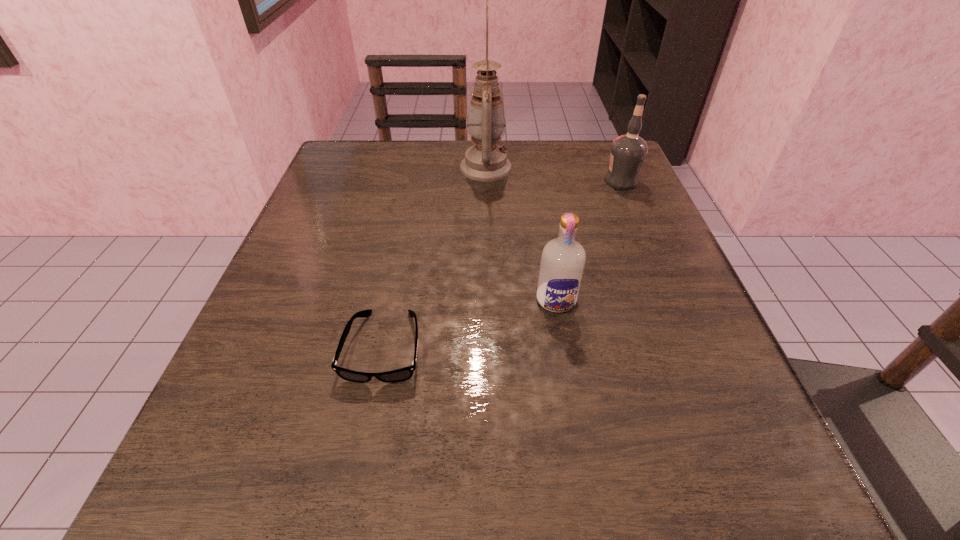
This screenshot has height=540, width=960. I want to click on vacant area between the right vodka and the left vodka, so click(588, 240).

What are the coordinates of `vacant space that is in between the right vodka and the nearer vodka` in the screenshot? It's located at (588, 240).

At what (x,y) coordinates should I click in order to perform the action: click on free space between the left vodka and the right vodka. Please return your answer as a coordinate pair (x, y). Looking at the image, I should click on (588, 240).

Find the location of a particular element. This screenshot has width=960, height=540. unoccupied area between the shortest object and the second object from left to right is located at coordinates (435, 258).

Locate an element on the screen. The height and width of the screenshot is (540, 960). vacant area that lies between the left vodka and the right vodka is located at coordinates (588, 240).

Locate an element on the screen. free space between the sunglasses and the right vodka is located at coordinates (503, 264).

Point out which object is positioned as the nearest to the shortest object. Please provide its 2D coordinates. Your answer should be formatted as a tuple, i.e. [(x, y)], where the tuple contains the x and y coordinates of a point satisfying the conditions above.

[(562, 263)]

The height and width of the screenshot is (540, 960). Find the location of `object that stands as the third closest to the oil lamp`. object that stands as the third closest to the oil lamp is located at coordinates (402, 374).

Where is `vacant space that satisfies the following two spatial constraints: 1. on the front label of the rightmost object; 2. on the label of the second object from right to left`? This screenshot has height=540, width=960. vacant space that satisfies the following two spatial constraints: 1. on the front label of the rightmost object; 2. on the label of the second object from right to left is located at coordinates (672, 300).